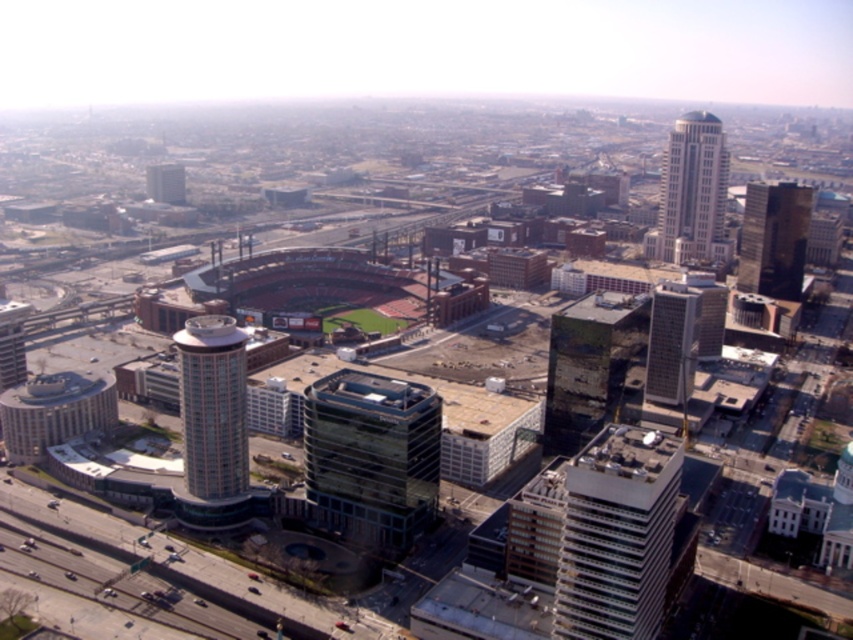
You are a drone operator who needs to capture a photo of the white glass skyscraper at upper right from a camera positioned at the camera. The minimum safe distance for clear photography is 600 meters. Is the current distance sufficient?

The white glass skyscraper at upper right and camera are 658.84 meters apart. Since 658.84 meters exceeds the minimum safe distance of 600 meters, the current distance is sufficient for clear photography.